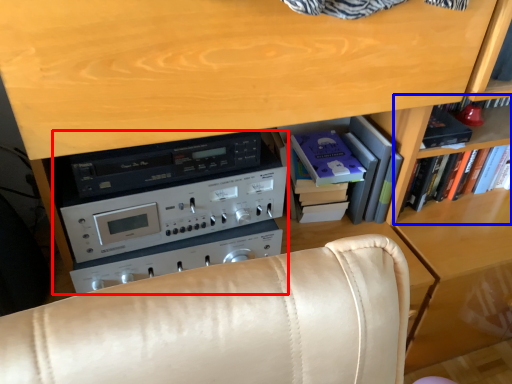
Question: Which of the following is the closest to the observer, appliance (highlighted by a red box) or shelf (highlighted by a blue box)?

Choices:
 (A) appliance
 (B) shelf

Answer: (A)